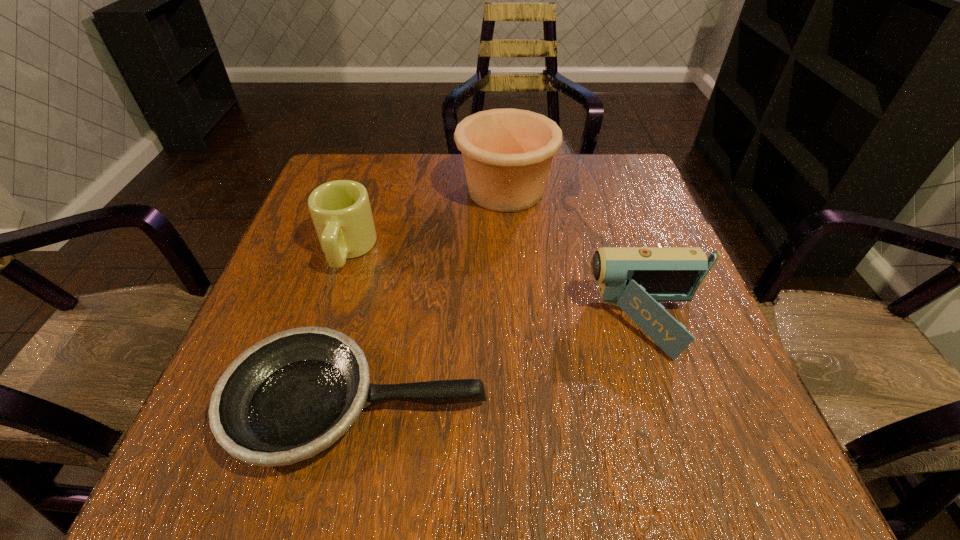
What are the coordinates of `vacant space at the right edge` in the screenshot? It's located at (597, 219).

The height and width of the screenshot is (540, 960). In order to click on free region at the far left corner in this screenshot , I will do click(x=321, y=185).

Identify the location of vacant region at the far right corner. This screenshot has width=960, height=540. (634, 204).

The width and height of the screenshot is (960, 540). I want to click on free spot between the shortest object and the tallest object, so [432, 298].

You are a GUI agent. You are given a task and a screenshot of the screen. Output one action in this format:
    pyautogui.click(x=<x>, y=<y>)
    Task: Click on the free space between the second farthest object and the pottery
    The image size is (960, 540).
    Given the screenshot: What is the action you would take?
    pyautogui.click(x=426, y=220)

Locate an element on the screen. The height and width of the screenshot is (540, 960). blank region between the mug and the rightmost object is located at coordinates (498, 287).

This screenshot has height=540, width=960. What are the coordinates of `blank region between the rightmost object and the pottery` in the screenshot? It's located at (578, 258).

Locate an element on the screen. The width and height of the screenshot is (960, 540). free space between the frying pan and the mug is located at coordinates (352, 327).

Identify the location of free spot between the shortest object and the mug. The width and height of the screenshot is (960, 540). (352, 327).

The width and height of the screenshot is (960, 540). Find the location of `unoccupied position between the second farthest object and the camcorder`. unoccupied position between the second farthest object and the camcorder is located at coordinates (498, 287).